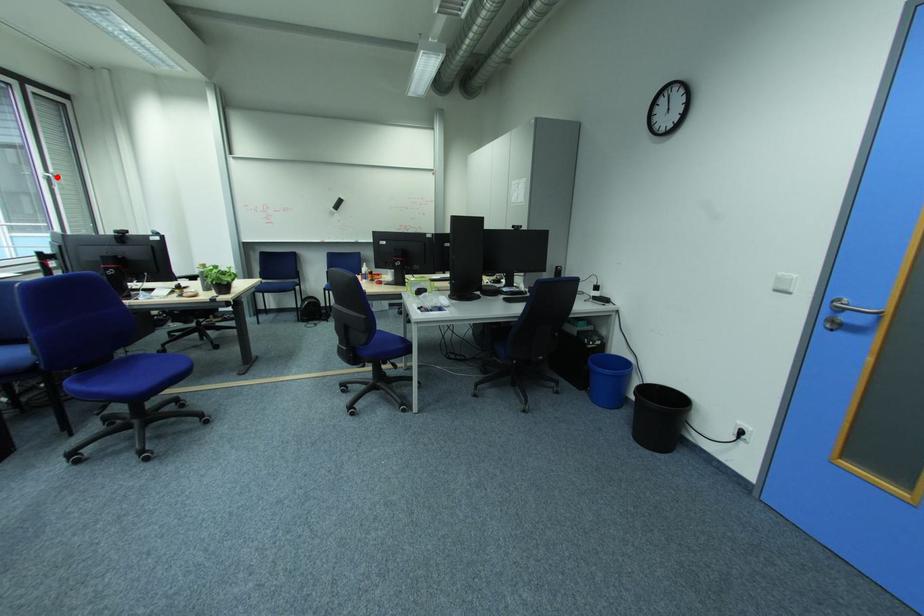
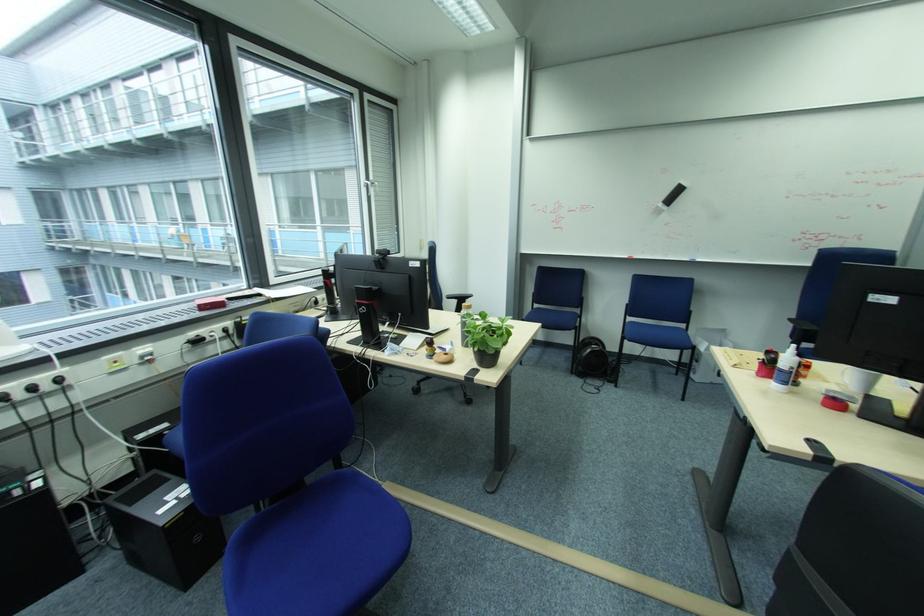
Question: I am providing you with two images of the same scene from different viewpoints. In image1, a red point is highlighted. Considering the same 3D point in image2, which of the following is correct?

Choices:
 (A) It is closer
 (B) It is farther

Answer: (A)